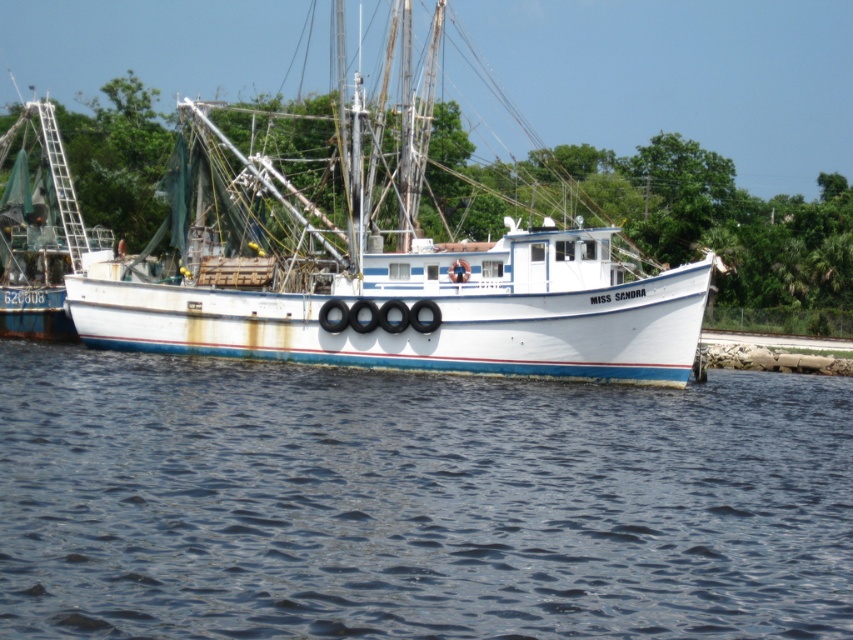
Does blue water at center appear on the left side of white matte boat at center?

No, blue water at center is not to the left of white matte boat at center.

Does blue water at center have a lesser height compared to white matte boat at center?

Yes.

Locate an element on the screen. The image size is (853, 640). blue water at center is located at coordinates (415, 502).

At what (x,y) coordinates should I click in order to perform the action: click on blue water at center. Please return your answer as a coordinate pair (x, y). Looking at the image, I should click on (415, 502).